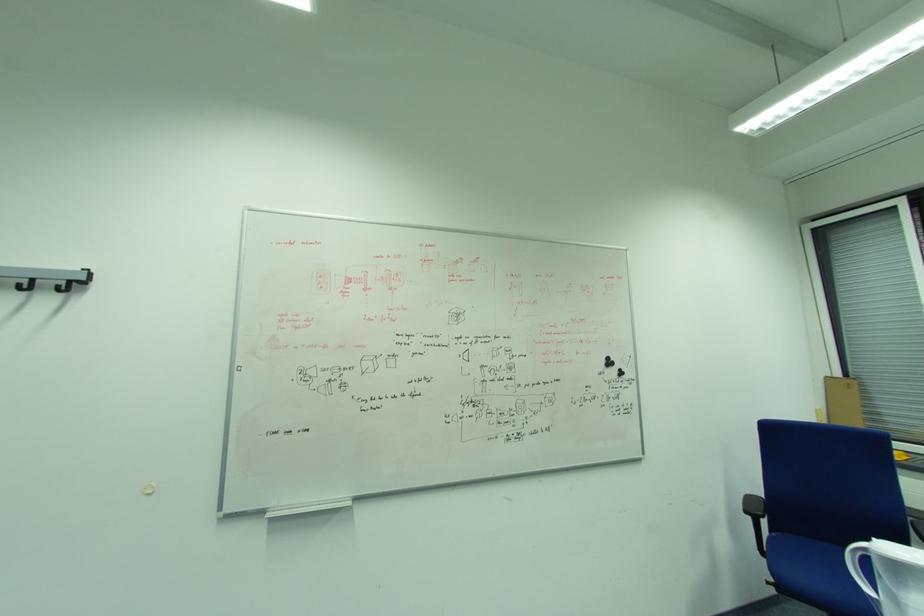
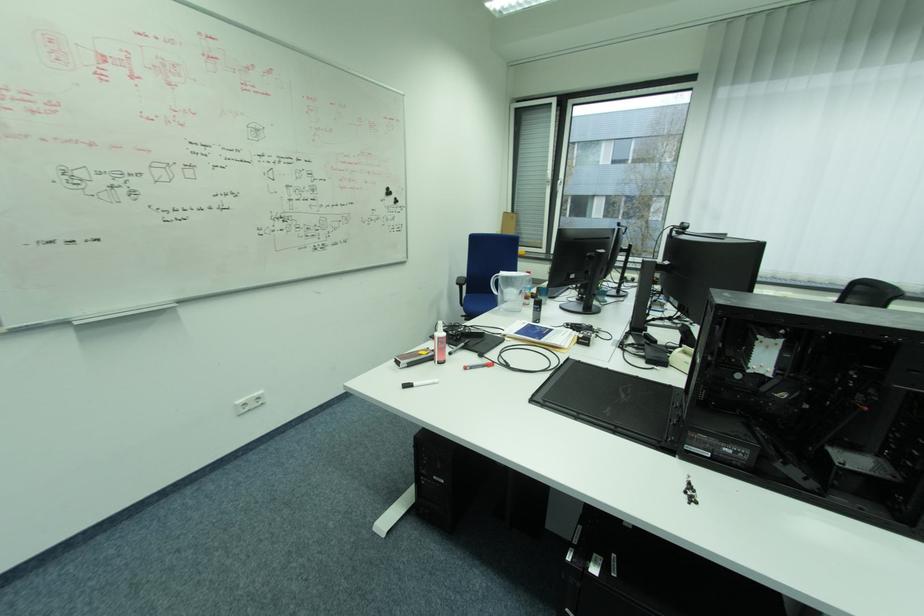
The point at (x=612, y=362) is marked in the first image. Where is the corresponding point in the second image?

(392, 192)